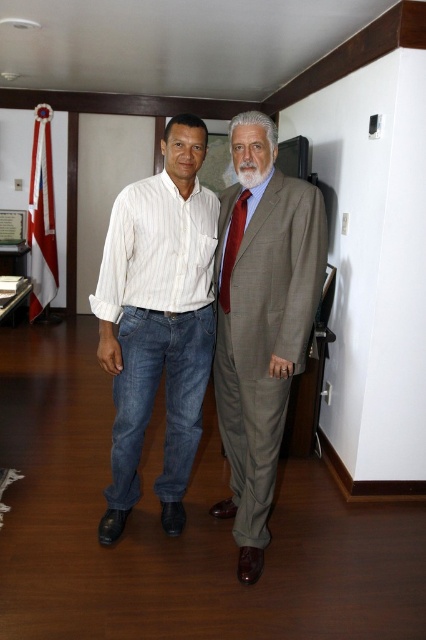
Question: Which object is farther from the camera taking this photo?

Choices:
 (A) white striped shirt at center
 (B) red silk tie at center

Answer: (B)

Question: Can you confirm if white striped shirt at center is bigger than smooth brown suit at center?

Choices:
 (A) yes
 (B) no

Answer: (B)

Question: Which point is closer to the camera taking this photo?

Choices:
 (A) tap(241, 227)
 (B) tap(104, 348)
 (C) tap(279, 433)

Answer: (A)

Question: Which of the following is the closest to the observer?

Choices:
 (A) white striped shirt at center
 (B) red silk tie at center

Answer: (A)

Question: Is white striped shirt at center thinner than red silk tie at center?

Choices:
 (A) yes
 (B) no

Answer: (B)

Question: Does smooth brown suit at center have a larger size compared to red silk tie at center?

Choices:
 (A) yes
 (B) no

Answer: (A)